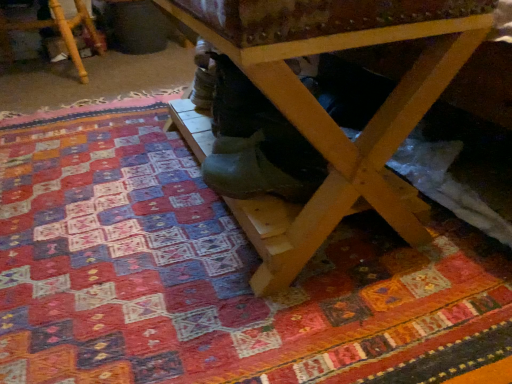
Locate an element on the screen. vacant space in front of wooden table at center is located at coordinates (251, 304).